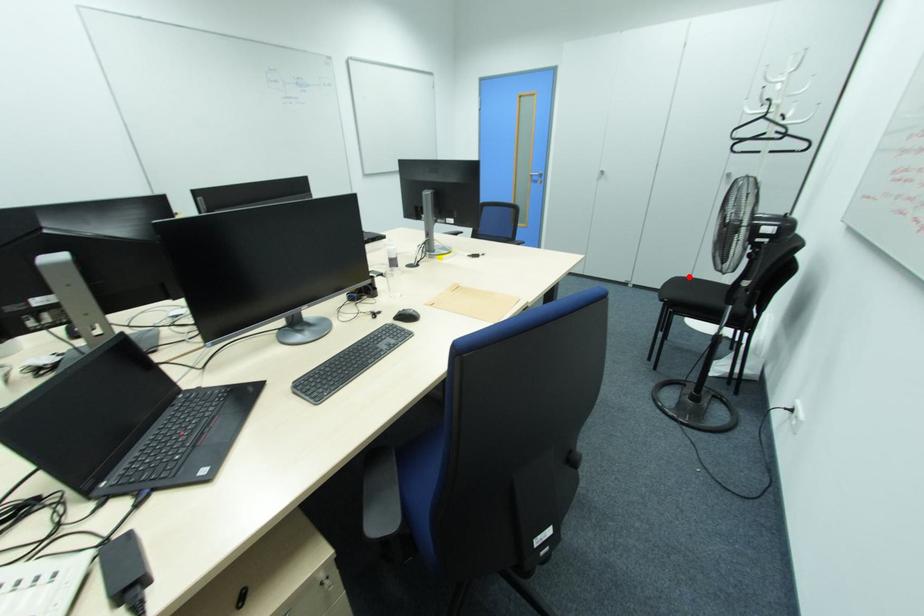
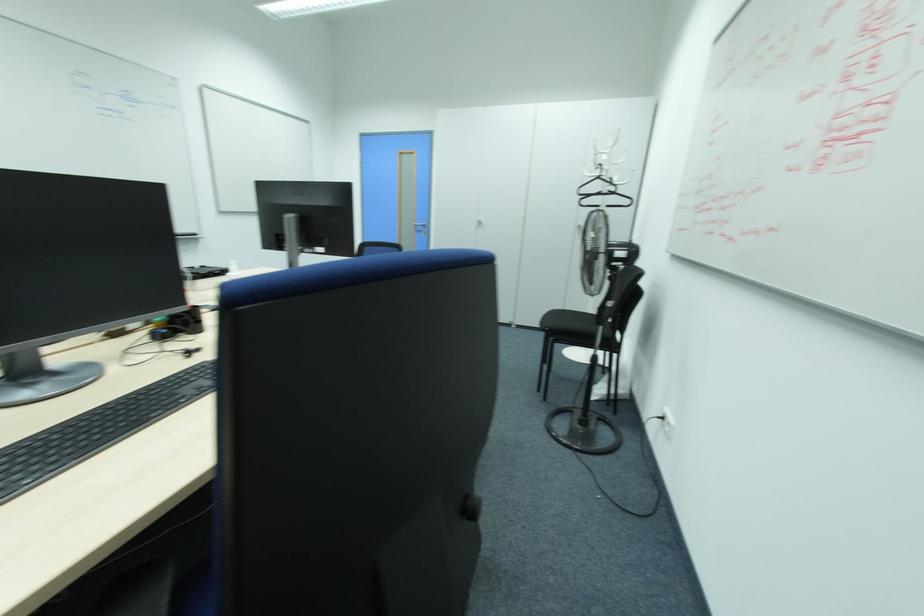
Where in the second image is the point corresponding to the highlighted location from the first image?

(562, 309)